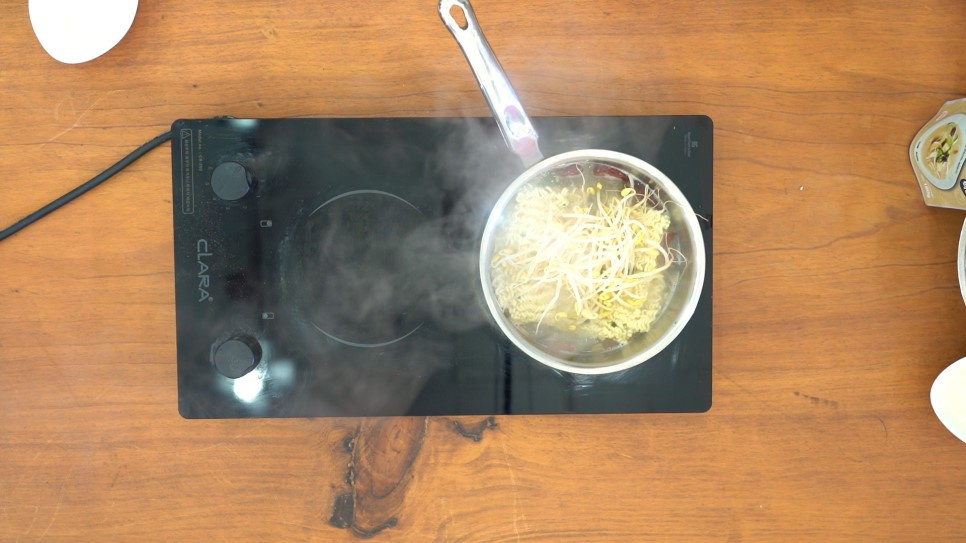
This screenshot has width=966, height=543. What are the coordinates of `pot handle` in the screenshot? It's located at [490, 79].